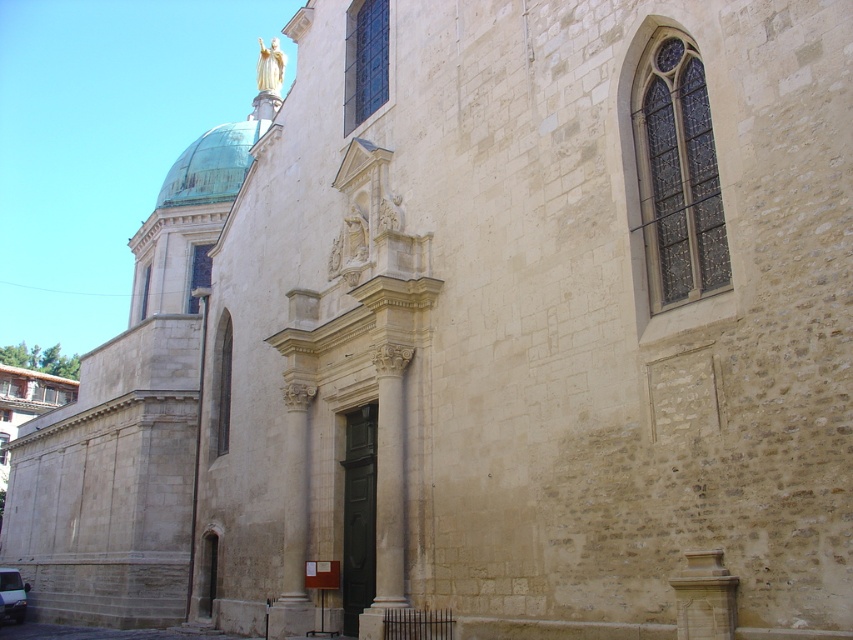
You are a photographer wanting to capture the green copper dome at upper left and the white glossy van at lower left in the same frame. Based on their positions, which object would appear closer to the top of the photo?

The green copper dome at upper left appears closer to the top of the photo because it is positioned over the white glossy van at lower left.

You are standing in front of the historic stone building and want to take a photo of both the green copper dome at upper left and the white glossy van at lower left. Which object should you focus on first to ensure both are in the frame?

You should focus on the green copper dome at upper left first because it is closer to you than the white glossy van at lower left, so adjusting the camera to include it will naturally include the van as well.